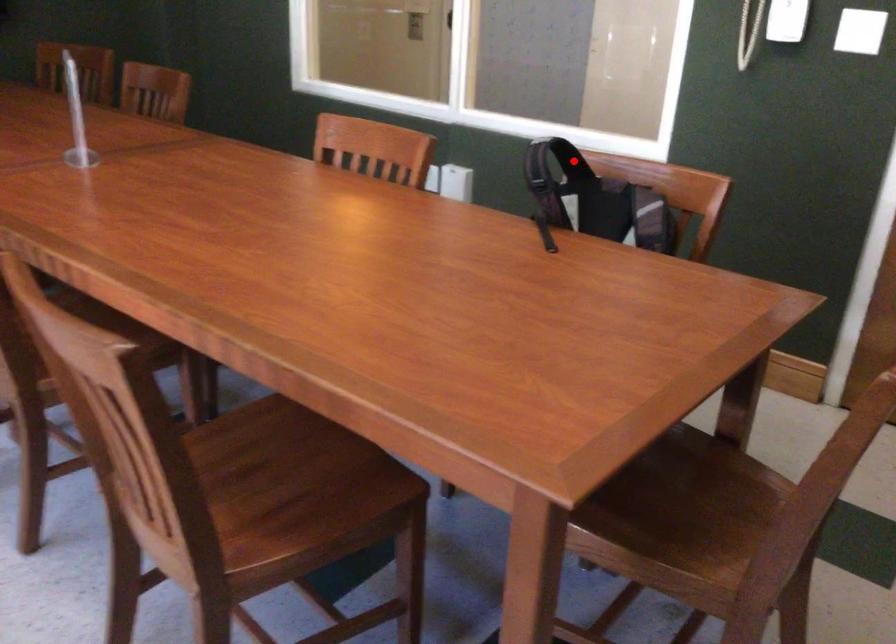
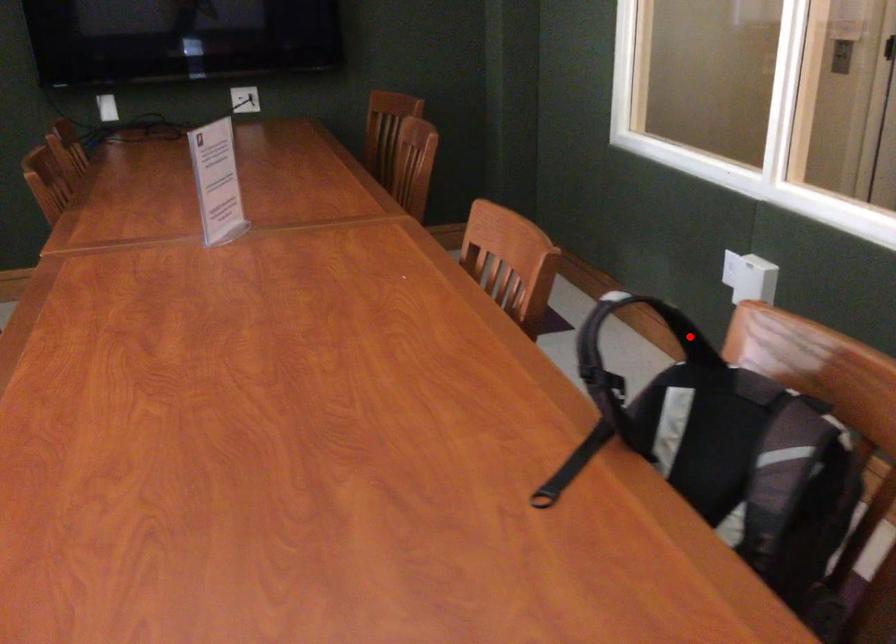
I am providing you with two images of the same scene from different viewpoints. A red point is marked on the first image and another point is marked on the second image. Is the marked point in image1 the same physical position as the marked point in image2?

Yes